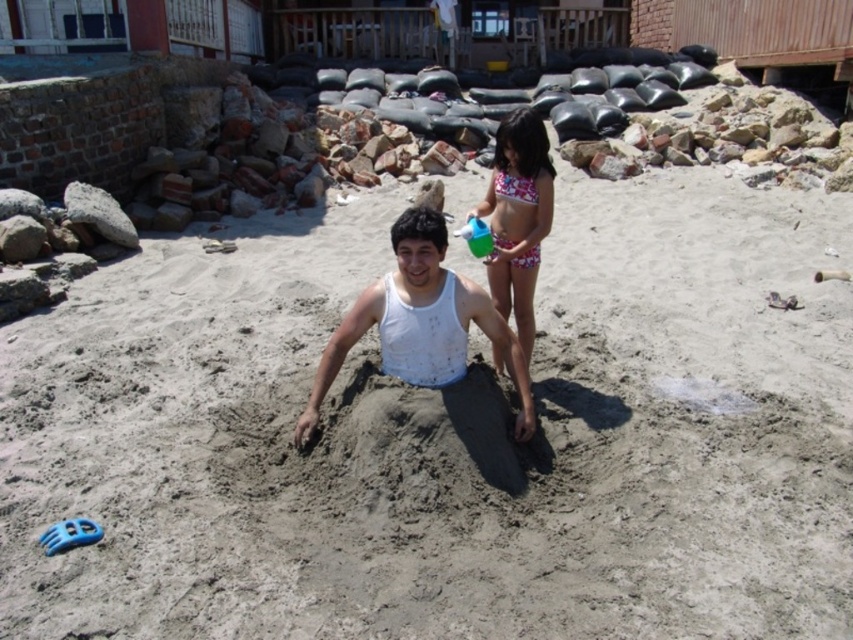
Question: Which of these objects is positioned farthest from the white matte tank top at center?

Choices:
 (A) gray sandy beach at center
 (B) pink floral swimsuit at upper center

Answer: (A)

Question: Which point appears closest to the camera in this image?

Choices:
 (A) (527, 292)
 (B) (791, 196)
 (C) (450, 342)

Answer: (C)

Question: Estimate the real-world distances between objects in this image. Which object is farther from the pink floral swimsuit at upper center?

Choices:
 (A) gray sandy beach at center
 (B) white matte tank top at center

Answer: (A)

Question: Is white matte tank top at center bigger than pink floral swimsuit at upper center?

Choices:
 (A) yes
 (B) no

Answer: (A)

Question: Can you confirm if gray sandy beach at center is positioned above pink floral swimsuit at upper center?

Choices:
 (A) no
 (B) yes

Answer: (A)

Question: Is white matte tank top at center below pink floral swimsuit at upper center?

Choices:
 (A) yes
 (B) no

Answer: (A)